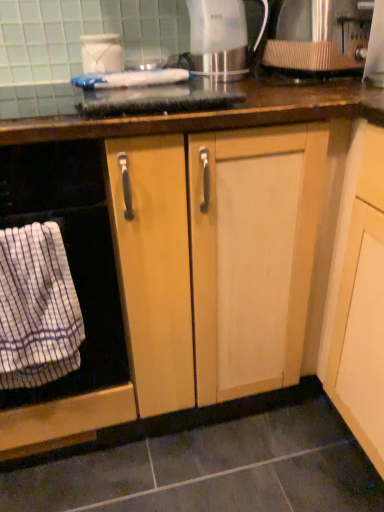
Question: Visually, is white striped cloth at left positioned to the left or to the right of white striped towel at left?

Choices:
 (A) right
 (B) left

Answer: (A)

Question: In the image, is white striped cloth at left positioned in front of or behind white striped towel at left?

Choices:
 (A) behind
 (B) front

Answer: (A)

Question: Based on their relative distances, which object is farther from the white striped towel at left?

Choices:
 (A) metallic silver kettle at upper center, which ranks as the 2th kitchen appliance in left-to-right order
 (B) white glossy jar at upper center, the 3th kitchen appliance viewed from the right
 (C) white striped cloth at left
 (D) metallic brushed coffee filter at upper right, the 3th kitchen appliance positioned from the left

Answer: (D)

Question: Estimate the real-world distances between objects in this image. Which object is farther from the metallic brushed coffee filter at upper right, which is the 1th kitchen appliance from right to left?

Choices:
 (A) white striped cloth at left
 (B) white striped towel at left
 (C) white glossy jar at upper center, the first kitchen appliance in the left-to-right sequence
 (D) metallic silver kettle at upper center, which ranks as the 2th kitchen appliance in left-to-right order

Answer: (A)